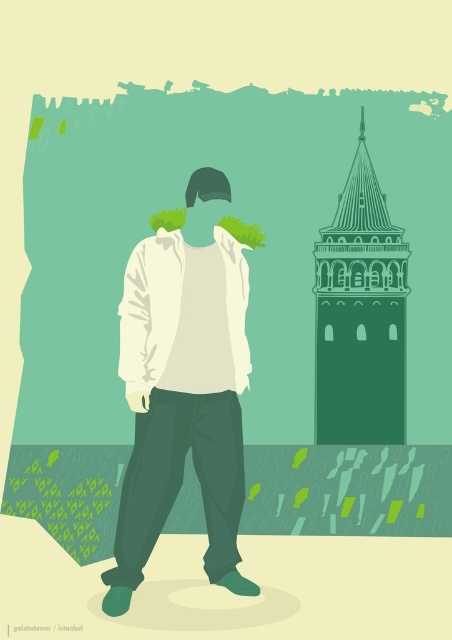
You are standing at the point closer to the tower in the image. Which point are you at, point (182, 435) or point (400, 273)?

You are at point (182, 435) because it is in front of point (400, 273), meaning it is closer to the tower.

In the scene shown: You are a painter standing in front of the scene. You want to paint the white matte shirt at center and the green line drawing tower at right. Which object should you paint first if you want to start with the taller one?

The white matte shirt at center is much taller than the green line drawing tower at right, so you should paint the white matte shirt at center first.